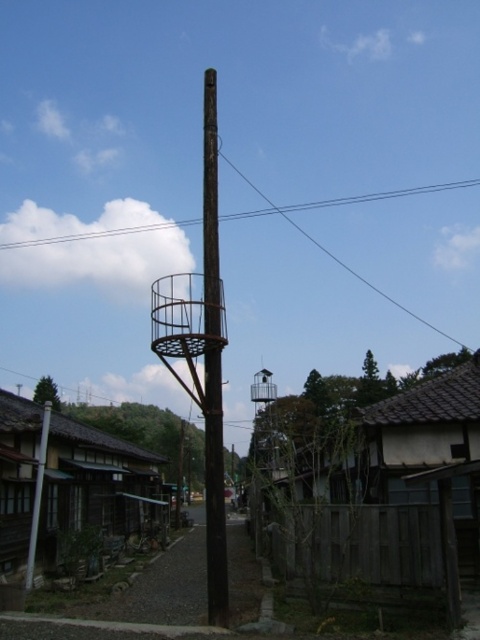
The image size is (480, 640). What do you see at coordinates (69, 483) in the screenshot?
I see `wooden shingles hut at lower left` at bounding box center [69, 483].

Does wooden shingles hut at lower left appear over black wire at upper center?

No, wooden shingles hut at lower left is not above black wire at upper center.

At what (x,y) coordinates should I click in order to perform the action: click on wooden shingles hut at lower left. Please return your answer as a coordinate pair (x, y). Looking at the image, I should click on (69, 483).

Which is more to the right, smooth black pole at center or rusty metal pole at left?

rusty metal pole at left is more to the right.

Where is `smooth black pole at center`? This screenshot has width=480, height=640. smooth black pole at center is located at coordinates (213, 369).

What do you see at coordinates (213, 369) in the screenshot?
I see `smooth black pole at center` at bounding box center [213, 369].

You are a GUI agent. You are given a task and a screenshot of the screen. Output one action in this format:
    pyautogui.click(x=<x>, y=<y>)
    Task: Click on the smooth black pole at center
    
    Given the screenshot: What is the action you would take?
    pyautogui.click(x=213, y=369)

Which is in front, point (64, 532) or point (267, 369)?

Point (64, 532) is in front.

Is point (0, 468) more distant than point (253, 392)?

That is False.

Locate an element on the screen. wooden shingles hut at lower left is located at coordinates (69, 483).